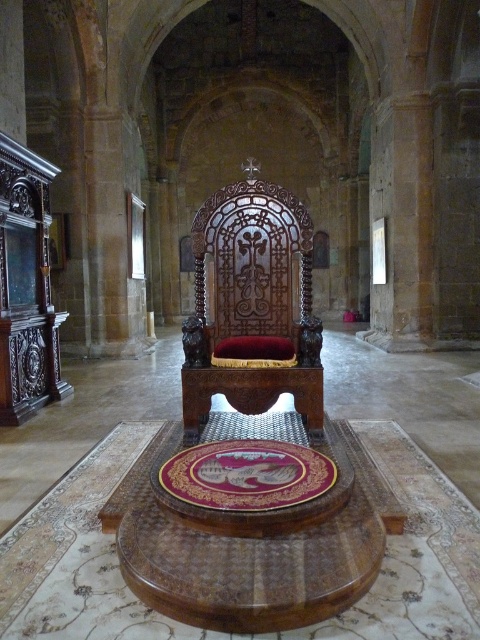
Is point (239, 378) positioned after point (162, 499)?

Yes, point (239, 378) is behind point (162, 499).

Which is behind, point (295, 317) or point (310, 467)?

Positioned behind is point (295, 317).

The height and width of the screenshot is (640, 480). Identify the location of polished wood throne at center. (252, 307).

Does polished wood throne at center have a larger size compared to polished wood round table at center?

Yes.

Is polished wood throne at center taller than polished wood round table at center?

Yes, polished wood throne at center is taller than polished wood round table at center.

Who is more distant from viewer, [247,406] or [287,568]?

Point [247,406]

Image resolution: width=480 pixels, height=640 pixels. I want to click on polished wood throne at center, so click(x=252, y=307).

The width and height of the screenshot is (480, 640). Describe the element at coordinates (251, 568) in the screenshot. I see `polished wood round table at center` at that location.

Can you confirm if polished wood round table at center is taller than gold-carved table at center?

Indeed, polished wood round table at center has a greater height compared to gold-carved table at center.

Is point (167, 556) farther from viewer compared to point (215, 481)?

No.

You are a GUI agent. You are given a task and a screenshot of the screen. Output one action in this format:
    pyautogui.click(x=<x>, y=<y>)
    Task: Click on the polished wood round table at center
    The image size is (480, 640).
    Given the screenshot: What is the action you would take?
    pyautogui.click(x=251, y=568)